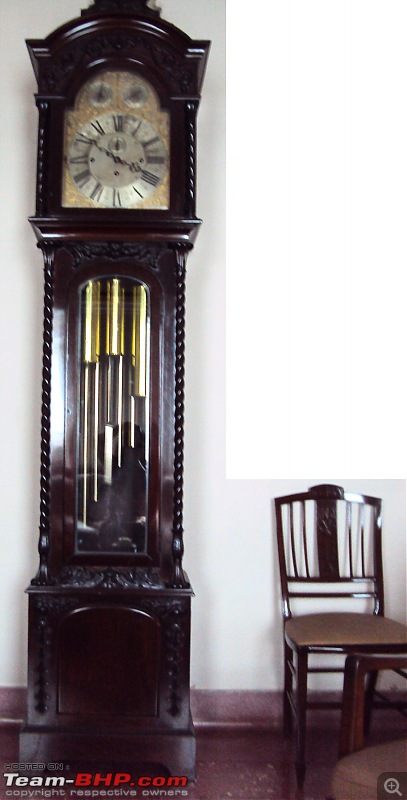
Locate an element on the screen. The image size is (407, 800). white background wall is located at coordinates (342, 628), (233, 549).